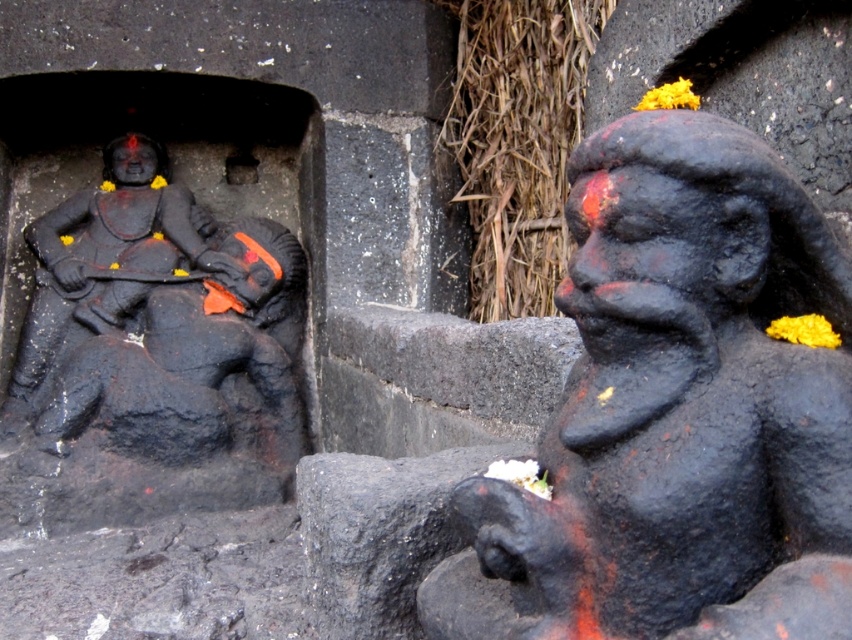
You are an art conservator assessing the placement of the sculptures in the temple. Given that the black stone monkey at right is shorter than the matte black statue at left, which sculpture would you recommend placing closer to the entrance to ensure visitors first notice the taller one?

The matte black statue at left is taller, so it should be placed closer to the entrance to ensure visitors first notice its height.

You are an art conservator assessing the structural stability of the sculptures. Given that the black stone monkey at right is smaller in width than the matte black statue at left, which sculpture might require more support to prevent toppling? Explain your reasoning based on their sizes.

The black stone monkey at right has a lesser width compared to the matte black statue at left. Since the monkey is narrower, it has a smaller base, making it more prone to toppling. Therefore, the black stone monkey at right would require more support to ensure stability.